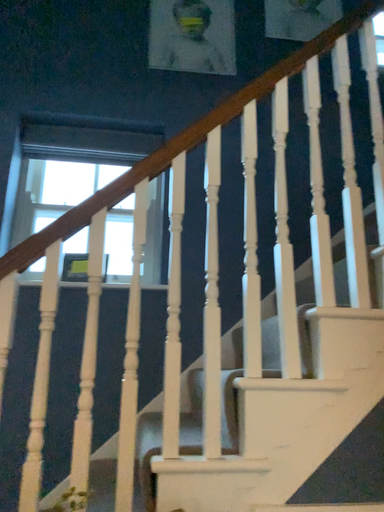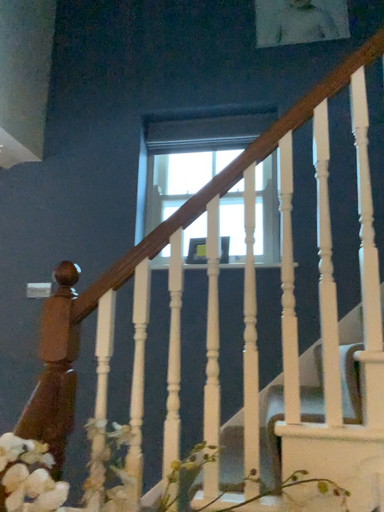
Question: How did the camera likely rotate when shooting the video?

Choices:
 (A) rotated right
 (B) rotated left

Answer: (B)